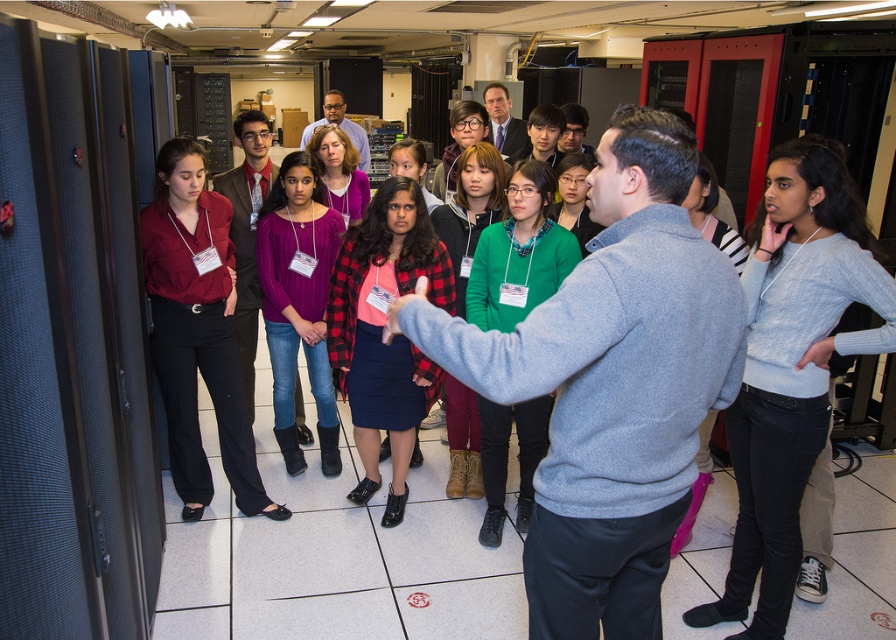
Is light gray sweater at center to the right of matte black pants at center from the viewer's perspective?

Yes, light gray sweater at center is to the right of matte black pants at center.

Which is in front, point (737, 460) or point (187, 456)?

Point (737, 460) is in front.

Which is in front, point (817, 413) or point (166, 412)?

Point (817, 413)

Locate an element on the screen. light gray sweater at center is located at coordinates 791,365.

How much distance is there between matte black pants at center and matte purple sweater at center?

matte black pants at center and matte purple sweater at center are 16.10 inches apart from each other.

Is matte black pants at center positioned before matte purple sweater at center?

Yes, matte black pants at center is closer to the viewer.

Is point (237, 428) closer to viewer compared to point (291, 288)?

Yes.

Locate an element on the screen. This screenshot has width=896, height=640. matte black pants at center is located at coordinates (196, 330).

Does plaid fabric shirt at center appear over matte purple sweater at center?

No, plaid fabric shirt at center is not above matte purple sweater at center.

Which is behind, point (337, 362) or point (317, 372)?

The point (317, 372) is behind.

This screenshot has width=896, height=640. What are the coordinates of `plaid fabric shirt at center` in the screenshot? It's located at (380, 332).

Find the location of a particular element. The image size is (896, 640). plaid fabric shirt at center is located at coordinates (380, 332).